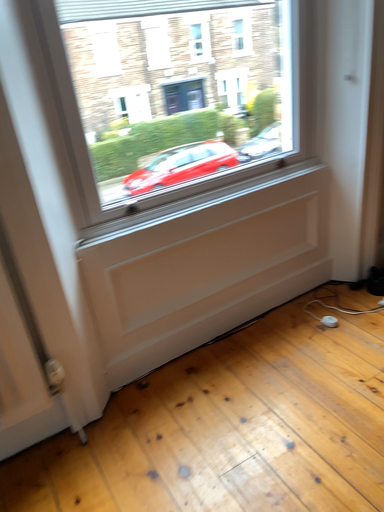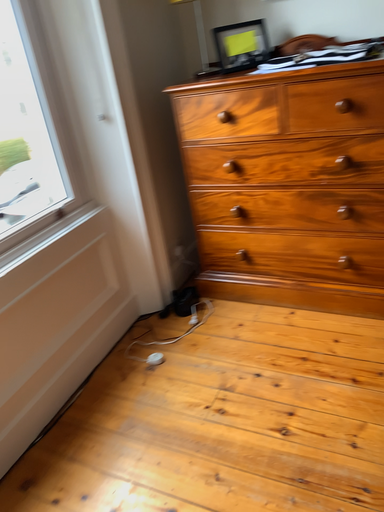
Question: Which way did the camera rotate in the video?

Choices:
 (A) rotated left
 (B) rotated right

Answer: (B)